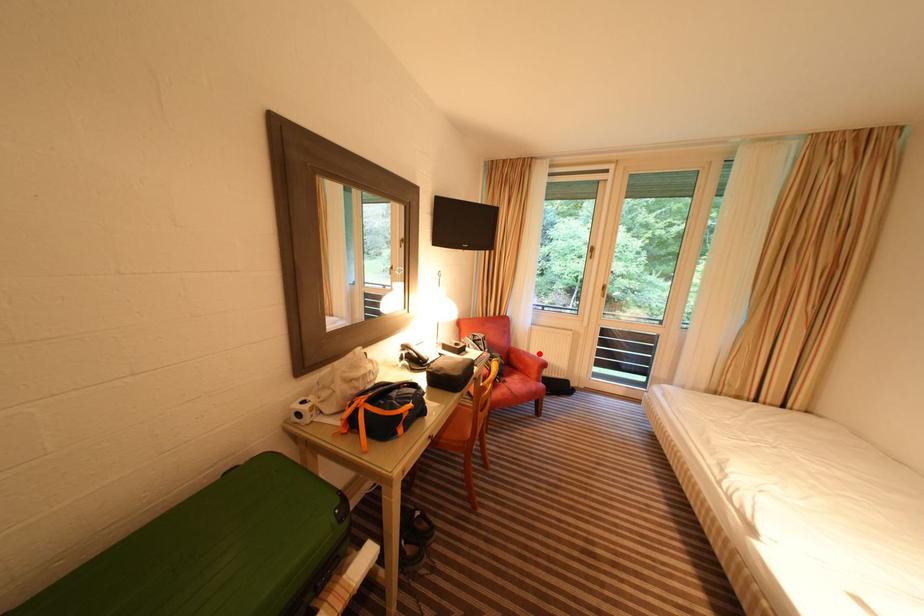
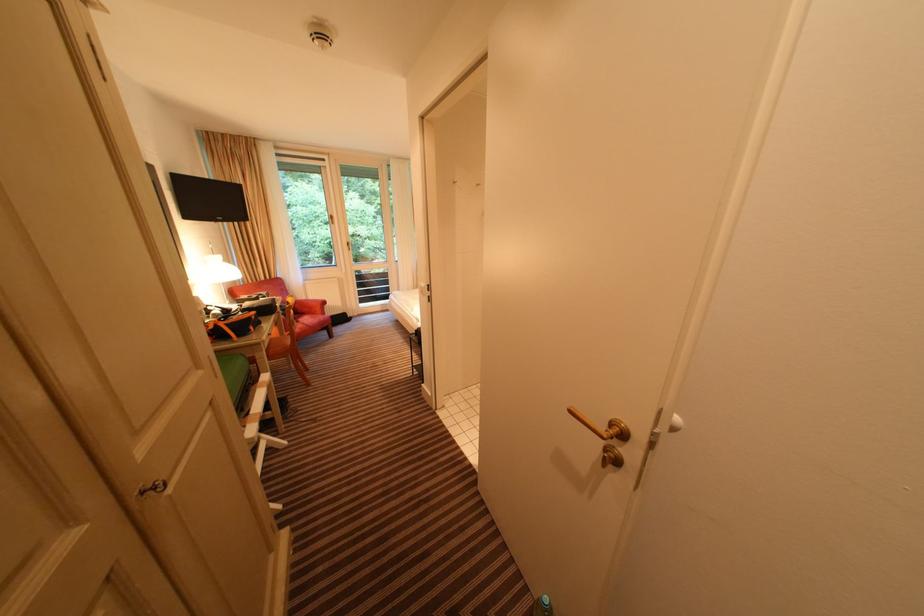
Locate, in the second image, the point that corresponds to the highlighted location in the first image.

(319, 300)